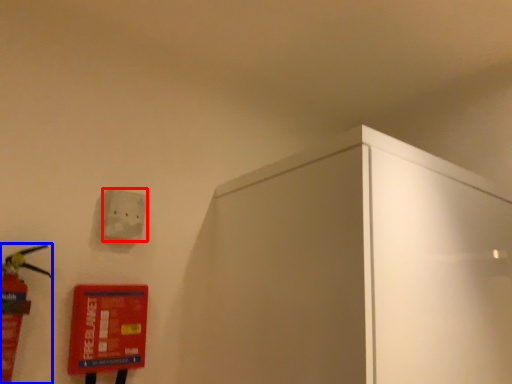
Question: Which of the following is the farthest to the observer, light switch (highlighted by a red box) or extinguisher (highlighted by a blue box)?

Choices:
 (A) light switch
 (B) extinguisher

Answer: (A)